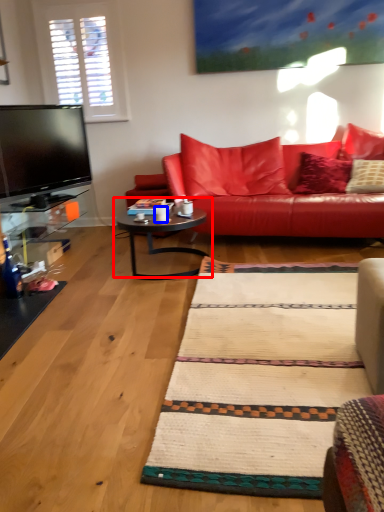
Question: Which object appears farthest to the camera in this image, coffee table (highlighted by a red box) or coffee cup (highlighted by a blue box)?

Choices:
 (A) coffee table
 (B) coffee cup

Answer: (B)